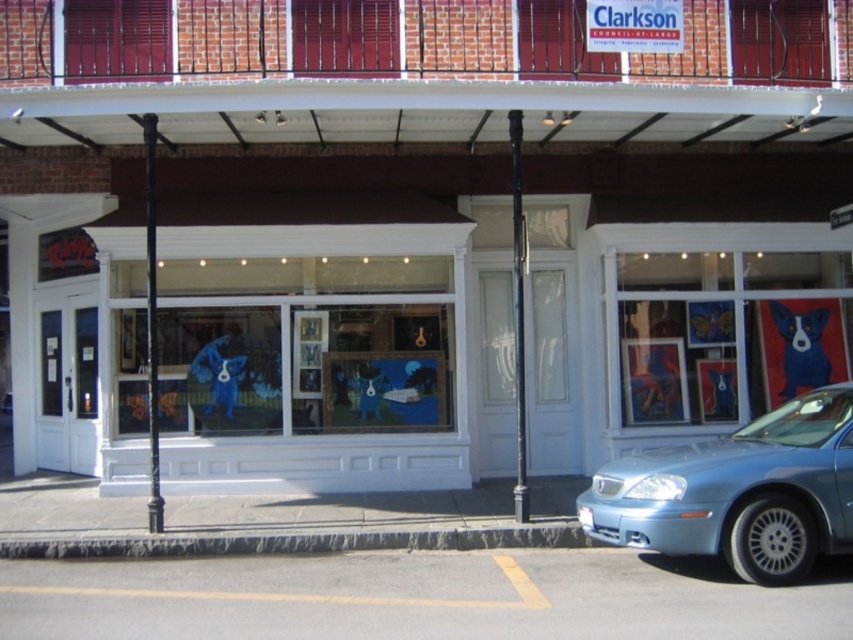
Is light blue metallic car at lower right to the left of blue glossy dog at center from the viewer's perspective?

Yes, light blue metallic car at lower right is to the left of blue glossy dog at center.

Can you confirm if light blue metallic car at lower right is shorter than blue glossy dog at center?

Indeed, light blue metallic car at lower right has a lesser height compared to blue glossy dog at center.

Identify the location of light blue metallic car at lower right. The height and width of the screenshot is (640, 853). (740, 492).

Identify the location of light blue metallic car at lower right. (740, 492).

Does matte glass window at center lie behind light blue metallic car at lower right?

Yes.

Consider the image. Can you confirm if matte glass window at center is wider than light blue metallic car at lower right?

Yes, matte glass window at center is wider than light blue metallic car at lower right.

Locate an element on the screen. This screenshot has height=640, width=853. matte glass window at center is located at coordinates (305, 369).

Between matte glass window at center and blue glossy dog at center, which one has more height?

blue glossy dog at center

Is matte glass window at center smaller than blue glossy dog at center?

Indeed, matte glass window at center has a smaller size compared to blue glossy dog at center.

Where is `matte glass window at center`? This screenshot has width=853, height=640. matte glass window at center is located at coordinates (305, 369).